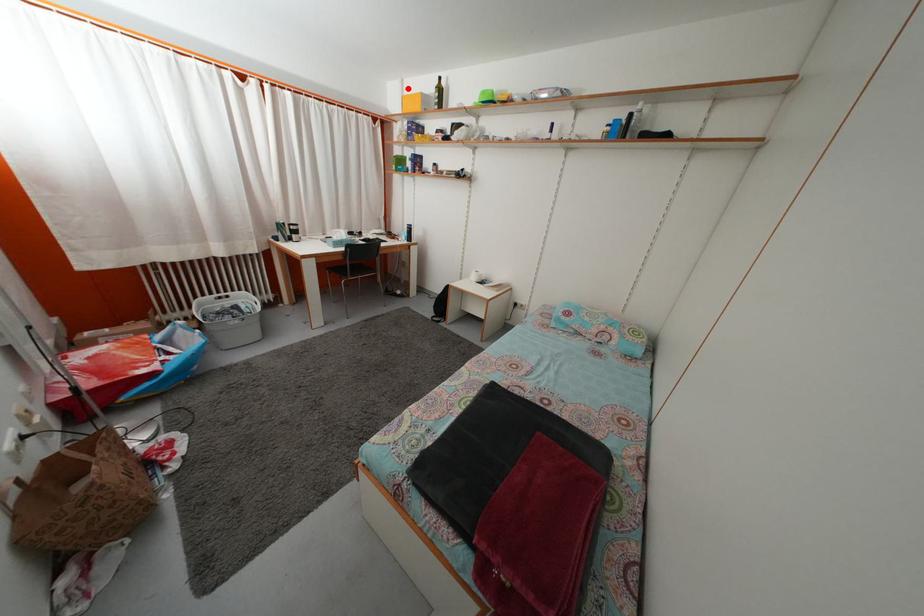
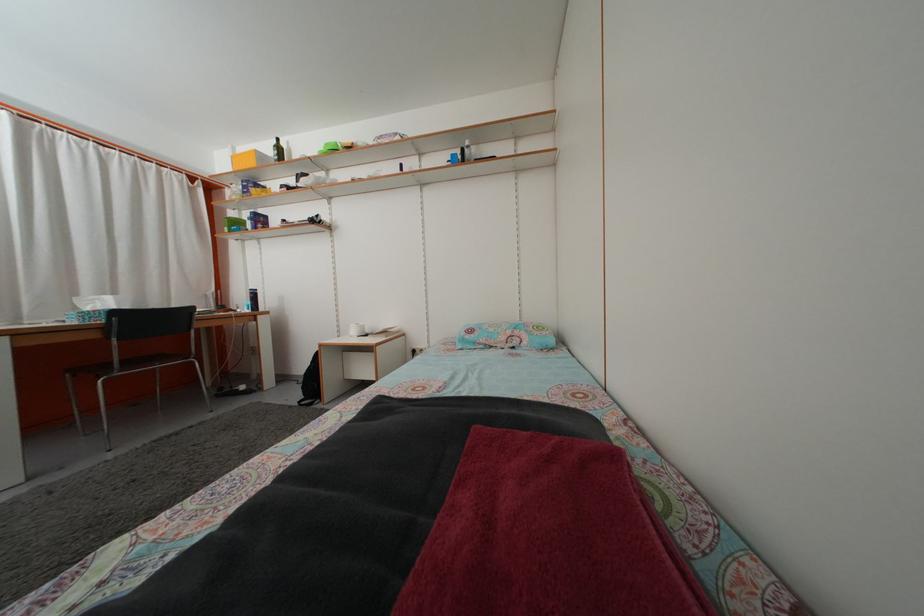
Where in the second image is the point corresponding to the highlighted location from the first image?

(239, 156)